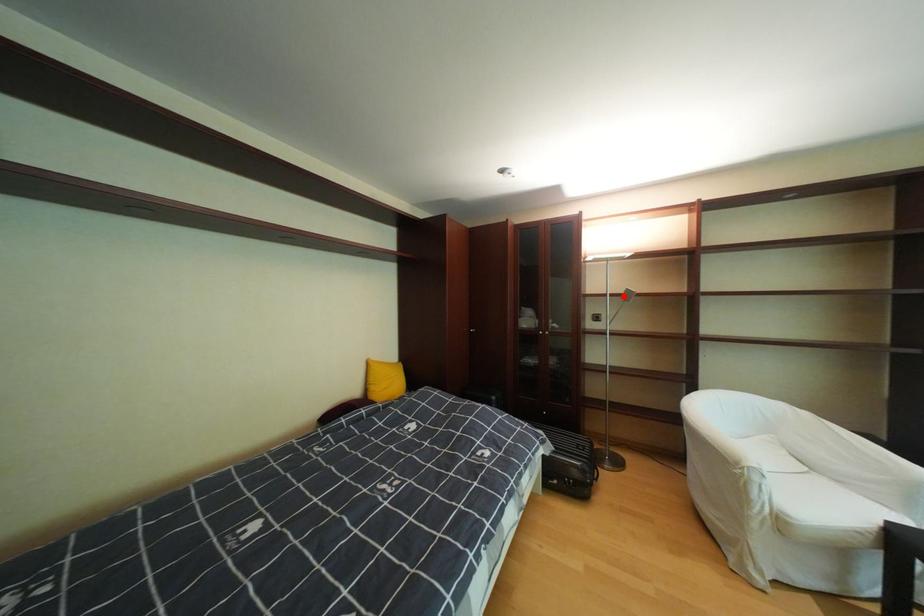
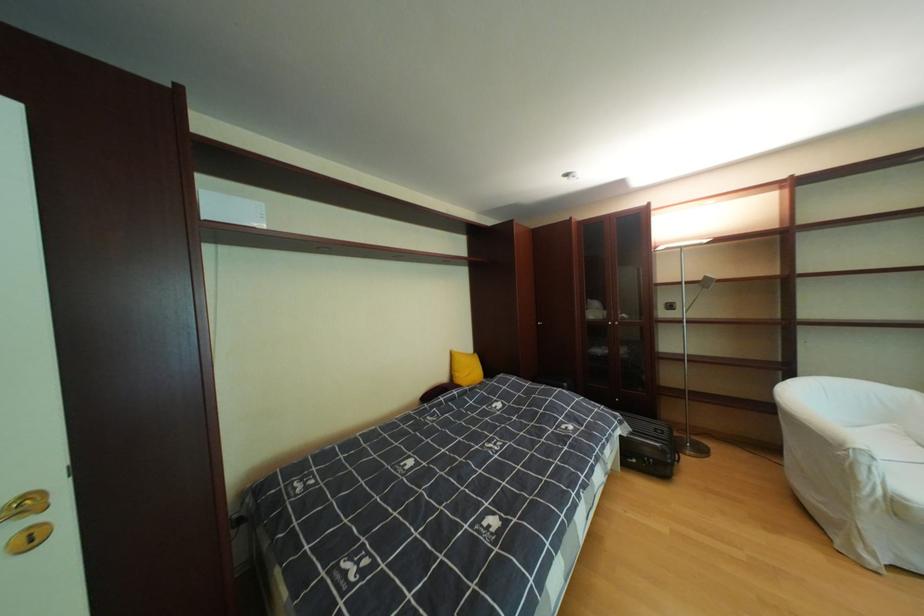
Question: I am providing you with two images of the same scene from different viewpoints. A red point is marked on the first image. Can you still see the location of the red point in image 2?

Choices:
 (A) Yes
 (B) No

Answer: (A)